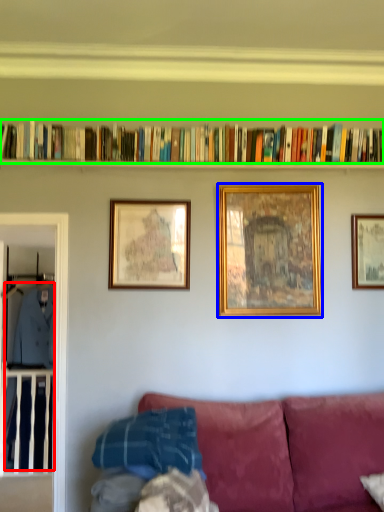
Question: Based on their relative distances, which object is nearer to clothing (highlighted by a red box)? Choose from picture frame (highlighted by a blue box) and book (highlighted by a green box).

Choices:
 (A) picture frame
 (B) book

Answer: (B)